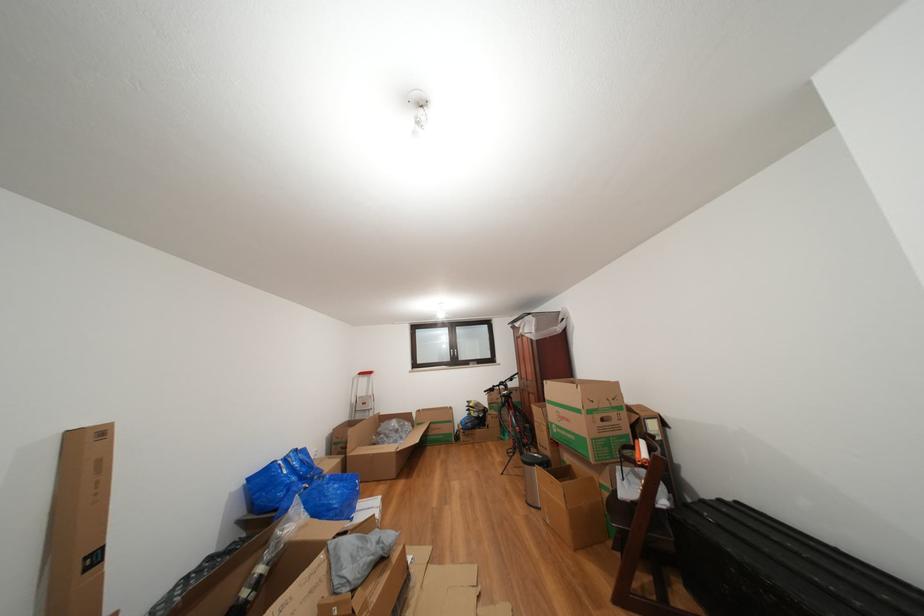
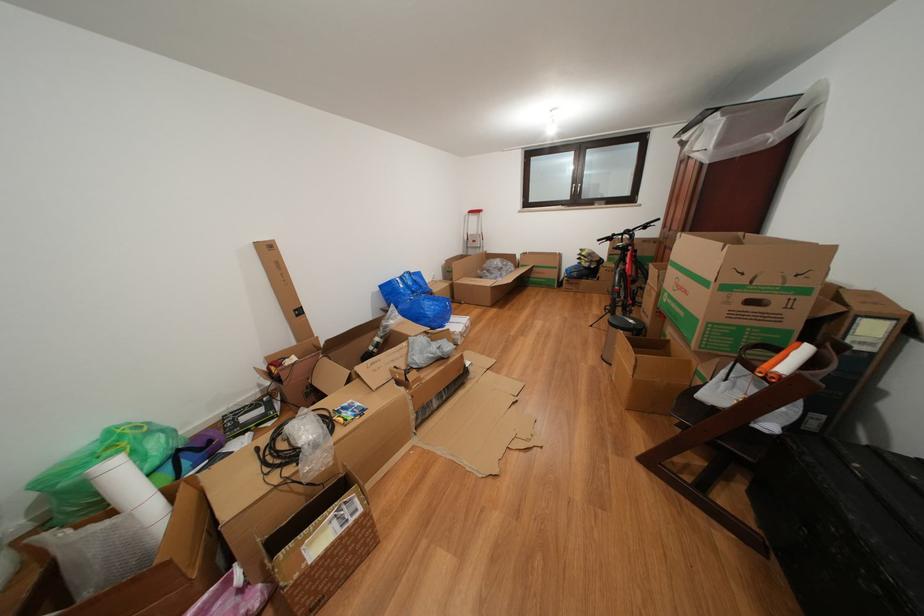
The point at (640, 453) is marked in the first image. Where is the corresponding point in the second image?

(784, 355)